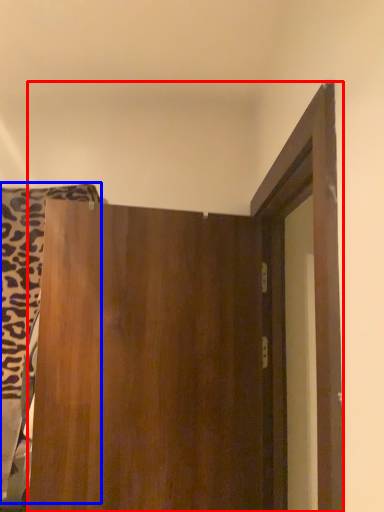
Question: Among these objects, which one is farthest to the camera, door (highlighted by a red box) or laundry (highlighted by a blue box)?

Choices:
 (A) door
 (B) laundry

Answer: (B)